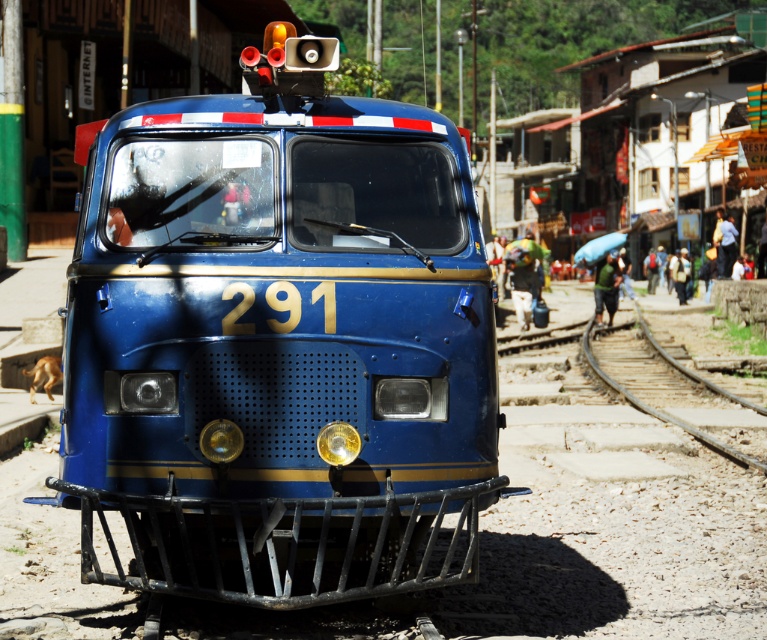
Question: Can you confirm if matte blue train at center is wider than brown wooden train track at lower right?

Choices:
 (A) yes
 (B) no

Answer: (A)

Question: Observing the image, what is the correct spatial positioning of matte blue train at center in reference to brown wooden train track at lower right?

Choices:
 (A) below
 (B) above

Answer: (A)

Question: Which object appears closest to the camera in this image?

Choices:
 (A) matte blue train at center
 (B) brown wooden train track at lower right

Answer: (A)

Question: Does matte blue train at center come behind brown wooden train track at lower right?

Choices:
 (A) yes
 (B) no

Answer: (B)